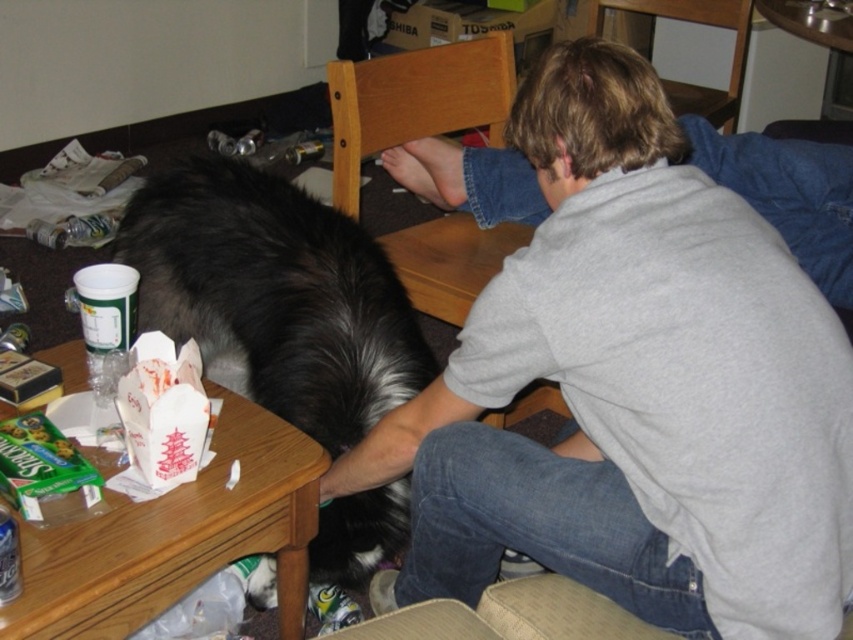
Question: Among these objects, which one is farthest from the camera?

Choices:
 (A) wooden table at lower left
 (B) black fur dog at center

Answer: (B)

Question: Is black fur dog at center wider than wooden table at lower left?

Choices:
 (A) yes
 (B) no

Answer: (A)

Question: Is the position of black fur dog at center more distant than that of wooden table at lower left?

Choices:
 (A) no
 (B) yes

Answer: (B)

Question: Does black fur dog at center have a greater width compared to wooden table at lower left?

Choices:
 (A) no
 (B) yes

Answer: (B)